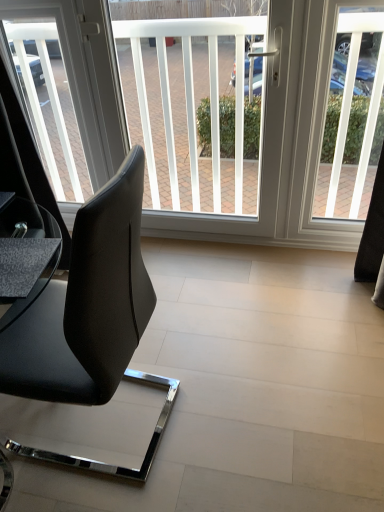
Question: Considering the positions of point (31, 301) and point (44, 28), is point (31, 301) closer or farther from the camera than point (44, 28)?

Choices:
 (A) closer
 (B) farther

Answer: (A)

Question: Is matte black table at lower left taller or shorter than transparent glass window screen at upper left, which is the third window screen from right to left?

Choices:
 (A) short
 (B) tall

Answer: (A)

Question: Which object is the farthest from the white plastic window screen at upper right, which is the first window screen from right to left?

Choices:
 (A) matte black table at lower left
 (B) transparent glass window screen at upper left, placed as the first window screen when sorted from left to right
 (C) black leather chair at left
 (D) white plastic window screen at center, the 2th window screen in the left-to-right sequence

Answer: (A)

Question: Which object is positioned farthest from the matte black table at lower left?

Choices:
 (A) black leather chair at left
 (B) white plastic window screen at center, the 2th window screen in the left-to-right sequence
 (C) white plastic window screen at upper right, the 3th window screen viewed from the left
 (D) transparent glass window screen at upper left, which is the third window screen from right to left

Answer: (C)